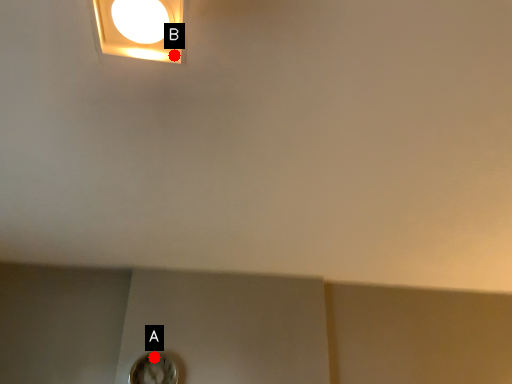
Question: Two points are circled on the image, labeled by A and B beside each circle. Which point appears closest to the camera in this image?

Choices:
 (A) A is closer
 (B) B is closer

Answer: (B)